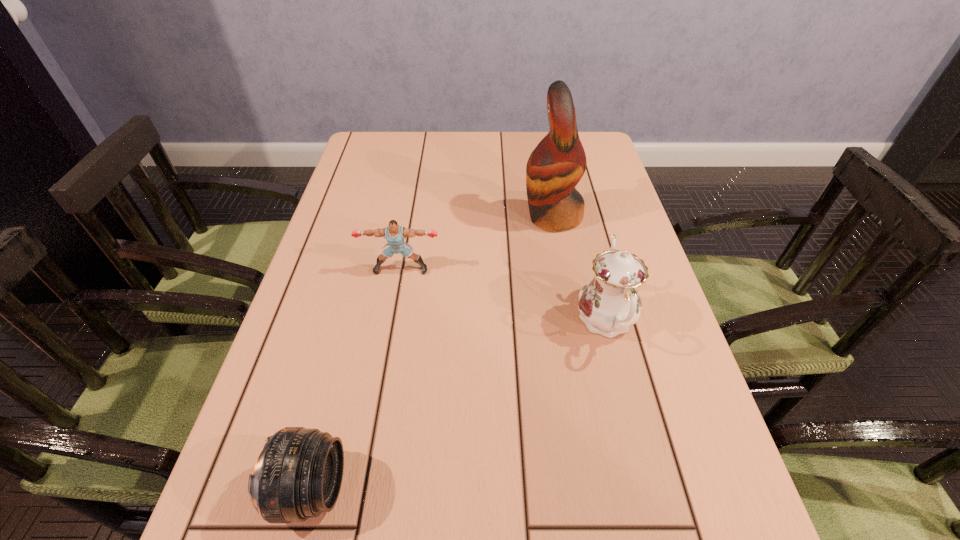
The width and height of the screenshot is (960, 540). I want to click on vacant space situated on the front-facing side of the puncher, so click(384, 368).

Identify the location of free space located at the front element of the telephoto lens. (539, 489).

This screenshot has height=540, width=960. In order to click on puncher present at the left edge in this screenshot , I will do `click(395, 234)`.

Find the location of a particular element. The height and width of the screenshot is (540, 960). telephoto lens located in the left edge section of the desktop is located at coordinates (298, 475).

You are a GUI agent. You are given a task and a screenshot of the screen. Output one action in this format:
    pyautogui.click(x=<x>, y=<y>)
    Task: Click on the parrot located in the right edge section of the desktop
    The width and height of the screenshot is (960, 540).
    Given the screenshot: What is the action you would take?
    pyautogui.click(x=557, y=164)

The image size is (960, 540). I want to click on chinaware located at the right edge, so click(609, 304).

The width and height of the screenshot is (960, 540). In the image, there is a desktop. Identify the location of vacant space at the far edge. [x=421, y=164].

Where is `free space at the left edge`? This screenshot has width=960, height=540. free space at the left edge is located at coordinates (325, 242).

Image resolution: width=960 pixels, height=540 pixels. In the image, there is a desktop. In order to click on vacant space at the right edge in this screenshot , I will do `click(593, 275)`.

Find the location of a particular element. Image resolution: width=960 pixels, height=540 pixels. vacant region at the far left corner of the desktop is located at coordinates (390, 159).